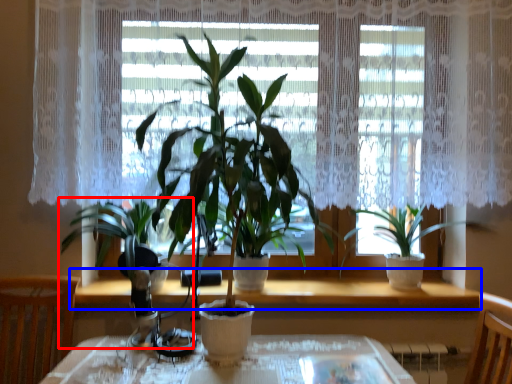
Question: Which of the following is the farthest to the observer, houseplant (highlighted by a red box) or window sill (highlighted by a blue box)?

Choices:
 (A) houseplant
 (B) window sill

Answer: (B)